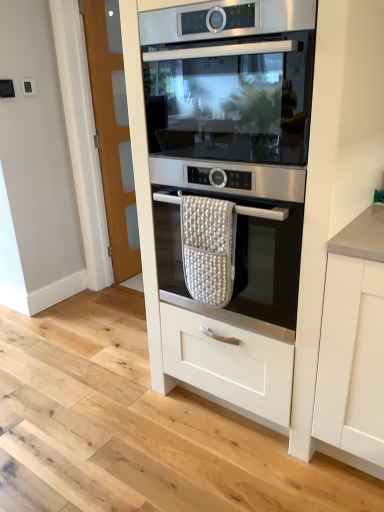
Describe the element at coordinates (228, 188) in the screenshot. This screenshot has height=512, width=384. I see `stainless steel oven at center, which is counted as the first oven, starting from the top` at that location.

Find the location of a particular element. This screenshot has height=512, width=384. stainless steel oven at center is located at coordinates (230, 82).

Describe the element at coordinates (239, 265) in the screenshot. I see `satin silver oven at center, the 1th oven from the bottom` at that location.

In order to click on white textured oven mitt at center in this screenshot , I will do `click(208, 248)`.

From a real-world perspective, between white textured oven mitt at center and satin silver oven at center, the 1th oven from the bottom, who is vertically lower?

white textured oven mitt at center, from a real-world perspective.

How far apart are white textured oven mitt at center and satin silver oven at center, marked as the second oven in a top-to-bottom arrangement?

4.07 inches.

Is white textured oven mitt at center positioned in front of satin silver oven at center, the 1th oven from the bottom?

No, the depth of white textured oven mitt at center is greater than that of satin silver oven at center, the 1th oven from the bottom.

Find the location of a particular element. Image resolution: width=384 pixels, height=512 pixels. the 2nd oven positioned below the stainless steel oven at center (from the image's perspective) is located at coordinates (239, 265).

Is satin silver oven at center, the 1th oven from the bottom, positioned far away from stainless steel oven at center?

They are positioned close to each other.

Looking at this image, what's the angular difference between satin silver oven at center, the 1th oven from the bottom, and stainless steel oven at center's facing directions?

satin silver oven at center, the 1th oven from the bottom, and stainless steel oven at center are facing 0.000532 degrees away from each other.

Based on the photo, could you measure the distance between satin silver oven at center, the 1th oven from the bottom, and stainless steel oven at center?

satin silver oven at center, the 1th oven from the bottom, is 13.57 inches away from stainless steel oven at center.

Is point (218, 286) farther from viewer compared to point (169, 48)?

Yes, point (218, 286) is farther from viewer.

Between white textured oven mitt at center and stainless steel oven at center, which one has larger width?

stainless steel oven at center.

Considering the positions of objects white textured oven mitt at center and stainless steel oven at center in the image provided, who is more to the right, white textured oven mitt at center or stainless steel oven at center?

From the viewer's perspective, stainless steel oven at center appears more on the right side.

Looking at this image, do you think white textured oven mitt at center is within stainless steel oven at center, or outside of it?

The correct answer is: outside.

From their relative heights in the image, would you say stainless steel oven at center, marked as the second oven in a bottom-to-top arrangement, is taller or shorter than satin silver oven at center, the 1th oven from the bottom?

Clearly, stainless steel oven at center, marked as the second oven in a bottom-to-top arrangement, is taller compared to satin silver oven at center, the 1th oven from the bottom.

Locate an element on the screen. This screenshot has width=384, height=512. oven located on the left of stainless steel oven at center, marked as the second oven in a bottom-to-top arrangement is located at coordinates (239, 265).

Is stainless steel oven at center, which is counted as the first oven, starting from the top, inside or outside of satin silver oven at center, marked as the second oven in a top-to-bottom arrangement?

The correct answer is: outside.

Considering the points (190, 42) and (220, 266), which point is behind, point (190, 42) or point (220, 266)?

Point (220, 266)

Between stainless steel oven at center, which is counted as the first oven, starting from the top, and white textured oven mitt at center, which one has larger size?

With larger size is stainless steel oven at center, which is counted as the first oven, starting from the top.

From a real-world perspective, which is physically below, stainless steel oven at center, which is counted as the first oven, starting from the top, or stainless steel oven at center?

stainless steel oven at center, which is counted as the first oven, starting from the top, from a real-world perspective.

Who is smaller, stainless steel oven at center, which is counted as the first oven, starting from the top, or stainless steel oven at center?

Smaller between the two is stainless steel oven at center.

Measure the distance from stainless steel oven at center, marked as the second oven in a bottom-to-top arrangement, to stainless steel oven at center.

stainless steel oven at center, marked as the second oven in a bottom-to-top arrangement, is 15.00 centimeters away from stainless steel oven at center.

Is stainless steel oven at center, marked as the second oven in a bottom-to-top arrangement, behind stainless steel oven at center?

No, it is not.

Is satin silver oven at center, marked as the second oven in a top-to-bottom arrangement, taller or shorter than white textured oven mitt at center?

Clearly, satin silver oven at center, marked as the second oven in a top-to-bottom arrangement, is taller compared to white textured oven mitt at center.

Identify the location of oven that is the 1st one when counting forward from the white textured oven mitt at center. The image size is (384, 512). (239, 265).

Is satin silver oven at center, the 1th oven from the bottom, completely or partially outside of white textured oven mitt at center?

satin silver oven at center, the 1th oven from the bottom, is positioned outside white textured oven mitt at center.

Which is behind, point (292, 286) or point (192, 258)?

The point (192, 258) is more distant.

This screenshot has height=512, width=384. Find the location of `material beneath the satin silver oven at center, marked as the second oven in a top-to-bottom arrangement (from a real-world perspective)`. material beneath the satin silver oven at center, marked as the second oven in a top-to-bottom arrangement (from a real-world perspective) is located at coordinates (208, 248).

Find the location of a particular element. This screenshot has height=512, width=384. oven that is the 1st one when counting rightward from the stainless steel oven at center is located at coordinates (239, 265).

Based on their spatial positions, is stainless steel oven at center, marked as the second oven in a bottom-to-top arrangement, or satin silver oven at center, the 1th oven from the bottom, further from white textured oven mitt at center?

stainless steel oven at center, marked as the second oven in a bottom-to-top arrangement.

Based on their spatial positions, is white textured oven mitt at center or stainless steel oven at center closer to stainless steel oven at center, marked as the second oven in a bottom-to-top arrangement?

stainless steel oven at center is positioned closer to the anchor stainless steel oven at center, marked as the second oven in a bottom-to-top arrangement.

Considering their positions, is stainless steel oven at center positioned closer to stainless steel oven at center, which is counted as the first oven, starting from the top, than satin silver oven at center, marked as the second oven in a top-to-bottom arrangement?

satin silver oven at center, marked as the second oven in a top-to-bottom arrangement.

From the image, which object appears to be nearer to satin silver oven at center, marked as the second oven in a top-to-bottom arrangement, white textured oven mitt at center or stainless steel oven at center?

white textured oven mitt at center is positioned closer to the anchor satin silver oven at center, marked as the second oven in a top-to-bottom arrangement.

Based on their spatial positions, is stainless steel oven at center, which is counted as the first oven, starting from the top, or white textured oven mitt at center further from satin silver oven at center, the 1th oven from the bottom?

stainless steel oven at center, which is counted as the first oven, starting from the top, is positioned further to the anchor satin silver oven at center, the 1th oven from the bottom.

When comparing their distances from satin silver oven at center, marked as the second oven in a top-to-bottom arrangement, does stainless steel oven at center or white textured oven mitt at center seem further?

stainless steel oven at center is further to satin silver oven at center, marked as the second oven in a top-to-bottom arrangement.

Which object lies further to the anchor point white textured oven mitt at center, satin silver oven at center, the 1th oven from the bottom, or stainless steel oven at center, which is counted as the first oven, starting from the top?

The object further to white textured oven mitt at center is stainless steel oven at center, which is counted as the first oven, starting from the top.

Looking at the image, which one is located further to stainless steel oven at center, which is counted as the first oven, starting from the top, stainless steel oven at center or white textured oven mitt at center?

white textured oven mitt at center is further to stainless steel oven at center, which is counted as the first oven, starting from the top.

I want to click on oven between stainless steel oven at center, which is counted as the first oven, starting from the top, and white textured oven mitt at center in the front-back direction, so pos(239,265).

Where is `oven between stainless steel oven at center and satin silver oven at center, the 1th oven from the bottom, in the vertical direction`? oven between stainless steel oven at center and satin silver oven at center, the 1th oven from the bottom, in the vertical direction is located at coordinates (228, 188).